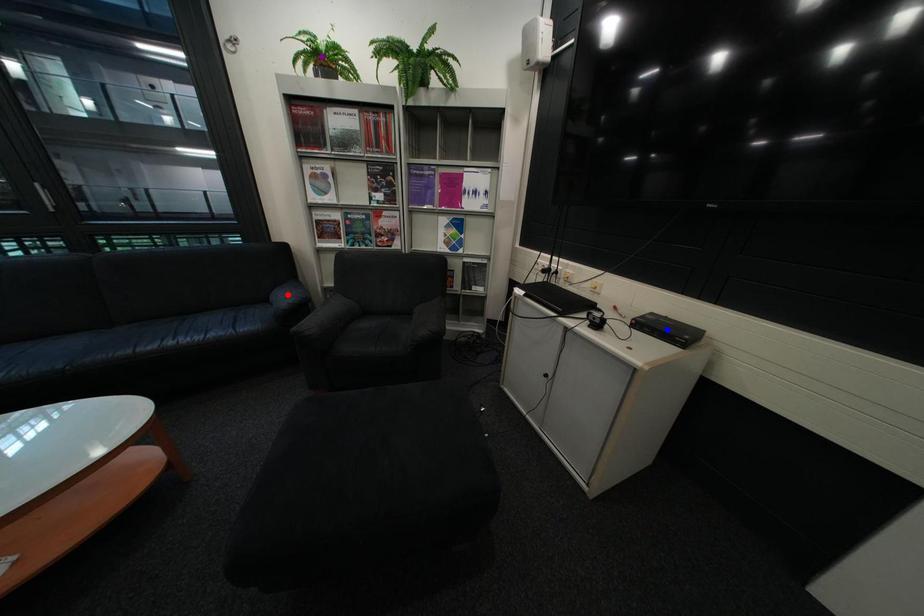
Order these from nearest to farthest:
red point, purple point, blue point

blue point, purple point, red point